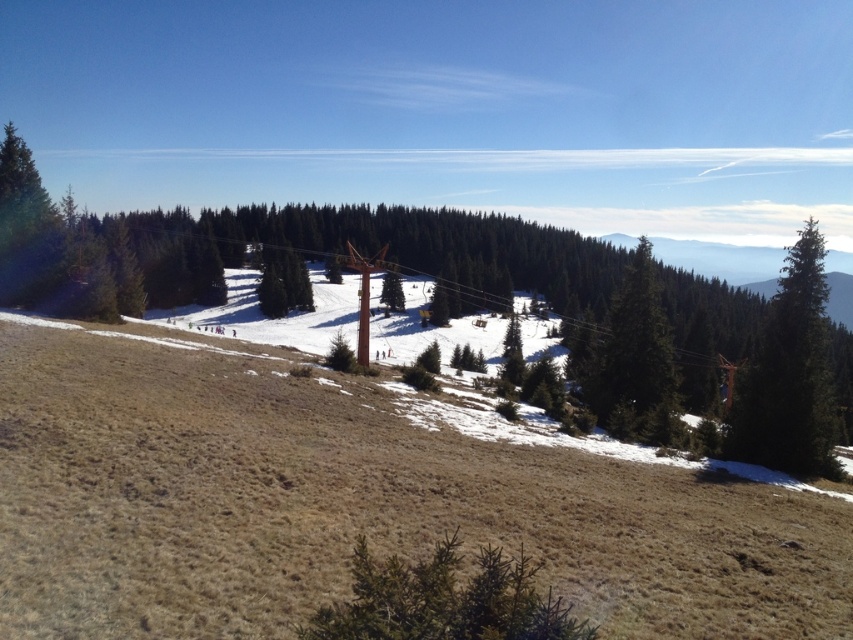
Is green matte tree at center-right above green matte tree at center?

Actually, green matte tree at center-right is below green matte tree at center.

Is point (666, 332) in front of point (386, 273)?

Yes, point (666, 332) is closer to viewer.

Locate an element on the screen. green matte tree at center-right is located at coordinates (635, 358).

In order to click on green matte tree at center-right in this screenshot , I will do `click(635, 358)`.

Is the position of green matte tree at lower center more distant than that of dark green coniferous tree at right?

No, it is not.

Who is lower down, green matte tree at lower center or dark green coniferous tree at right?

green matte tree at lower center

Who is more forward, (x=389, y=632) or (x=828, y=461)?

Positioned in front is point (x=389, y=632).

This screenshot has height=640, width=853. I want to click on green matte tree at lower center, so click(x=445, y=600).

Is point (329, 628) in front of point (387, 291)?

Yes, it is.

Between green matte tree at lower center and green matte tree at center, which one has less height?

Standing shorter between the two is green matte tree at lower center.

From the picture: Who is more forward, (376, 596) or (381, 280)?

Point (376, 596) is in front.

Locate an element on the screen. green matte tree at lower center is located at coordinates (445, 600).